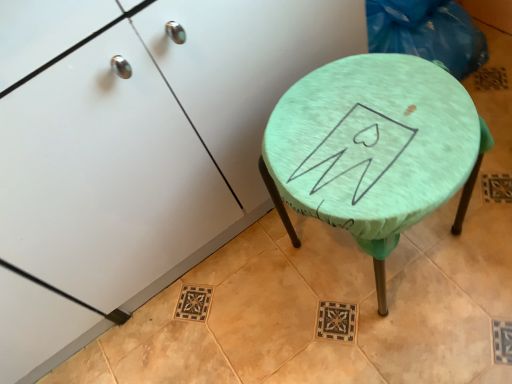
The image size is (512, 384). Find the location of `vacant area that lies in front of teal fabric-covered stool at center`. vacant area that lies in front of teal fabric-covered stool at center is located at coordinates (440, 330).